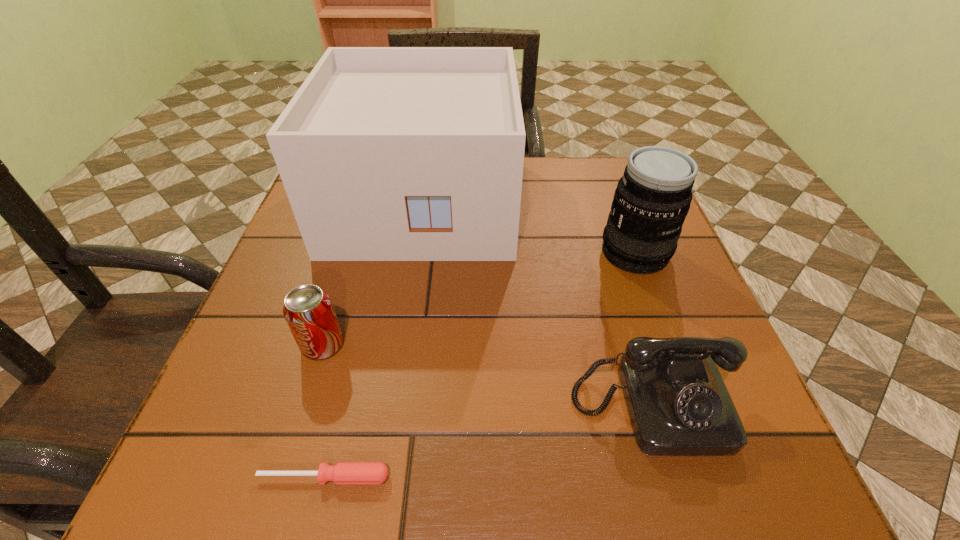
I want to click on object located in the far edge section of the desktop, so click(386, 153).

The image size is (960, 540). I want to click on telephone that is at the near edge, so click(678, 404).

In order to click on screwdriver that is at the near edge in this screenshot , I will do `click(343, 472)`.

At what (x,y) coordinates should I click in order to perform the action: click on box located in the left edge section of the desktop. Please return your answer as a coordinate pair (x, y). The width and height of the screenshot is (960, 540). Looking at the image, I should click on (386, 153).

The height and width of the screenshot is (540, 960). I want to click on soda can present at the left edge, so click(x=308, y=310).

The height and width of the screenshot is (540, 960). In order to click on screwdriver at the left edge in this screenshot , I will do (x=343, y=472).

The image size is (960, 540). Find the location of `telephoto lens that is at the right edge`. telephoto lens that is at the right edge is located at coordinates (652, 199).

What are the coordinates of `telephone present at the right edge` in the screenshot? It's located at pos(678,404).

The height and width of the screenshot is (540, 960). I want to click on object positioned at the far left corner, so click(x=386, y=153).

You are a GUI agent. You are given a task and a screenshot of the screen. Output one action in this format:
    pyautogui.click(x=<x>, y=<y>)
    Task: Click on the object present at the near left corner
    
    Given the screenshot: What is the action you would take?
    pyautogui.click(x=343, y=472)